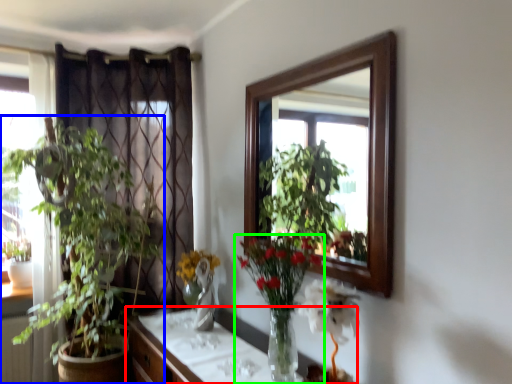
Question: Considering the real-world distances, which object is closest to cabinetry (highlighted by a red box)? houseplant (highlighted by a blue box) or houseplant (highlighted by a green box).

Choices:
 (A) houseplant
 (B) houseplant

Answer: (B)